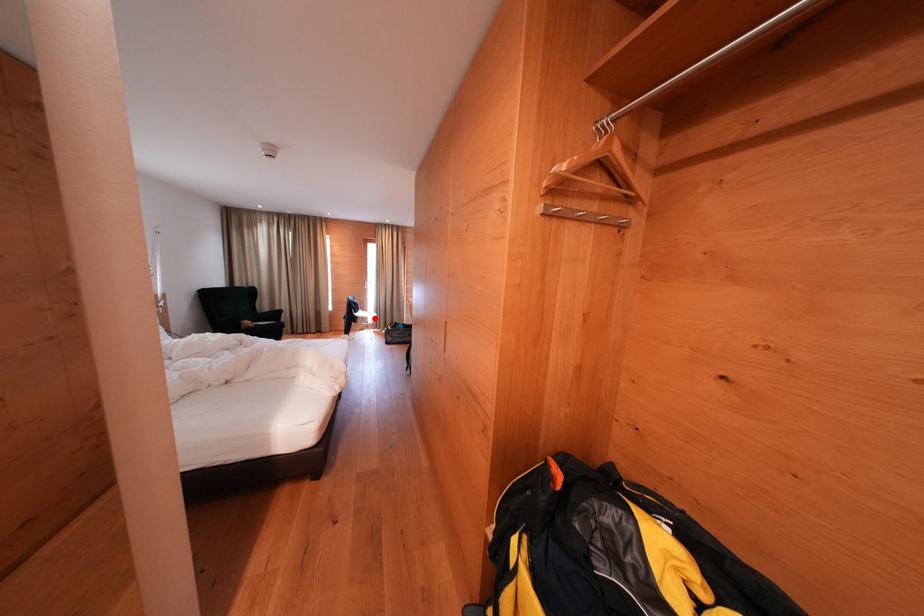
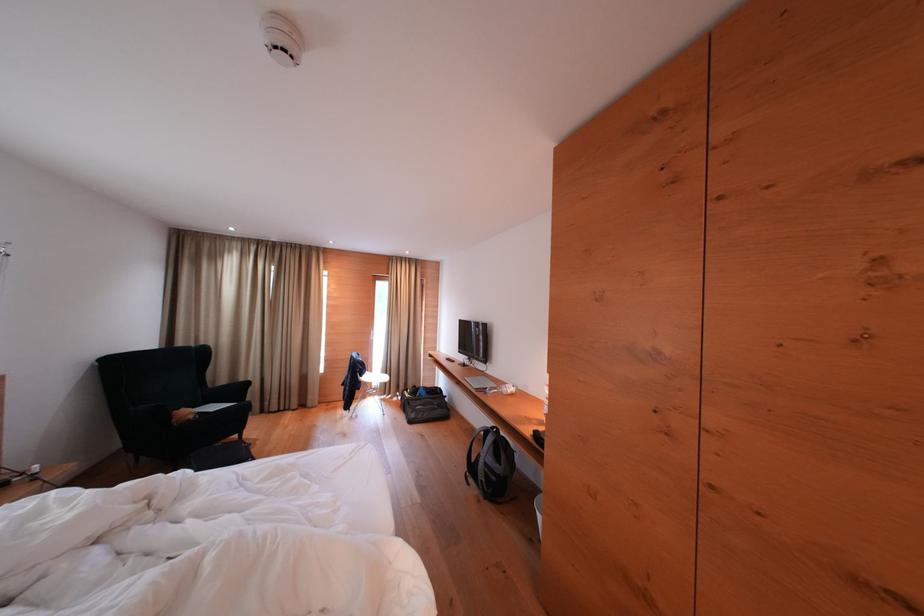
Question: A red point is marked in image1. In image2, is the corresponding 3D point closer to the camera or farther? Reply with the corresponding letter.

Choices:
 (A) The corresponding 3D point is closer.
 (B) The corresponding 3D point is farther.

Answer: (B)